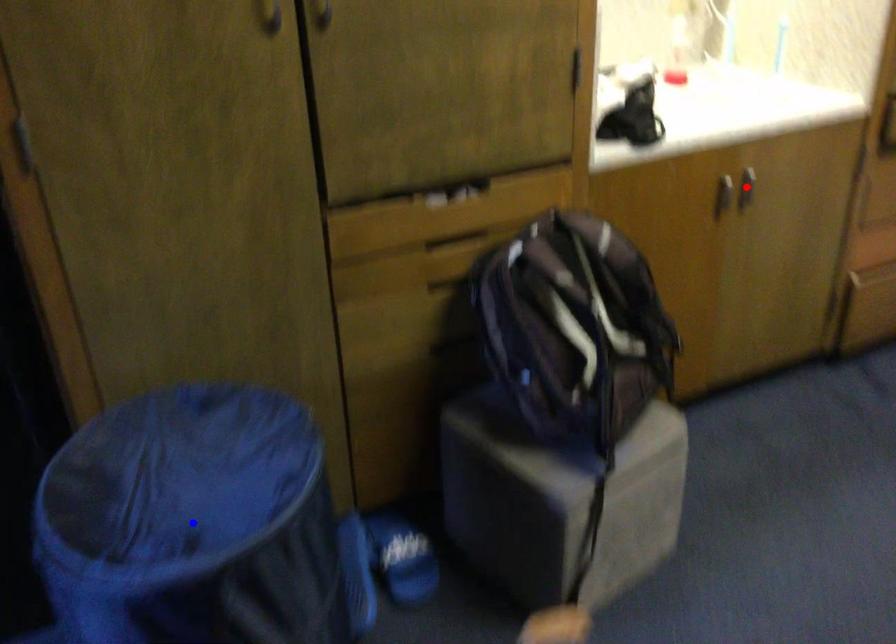
Question: Which of the two points in the image is closer to the camera?

Choices:
 (A) Blue point is closer.
 (B) Red point is closer.

Answer: (A)